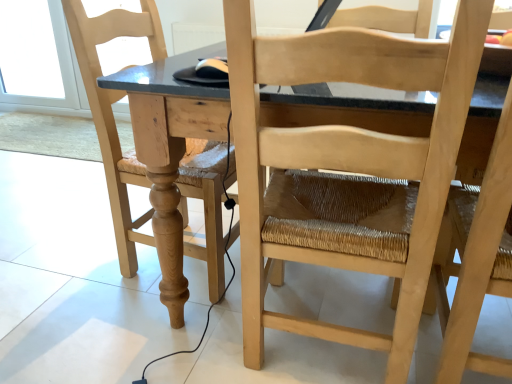
You are a GUI agent. You are given a task and a screenshot of the screen. Output one action in this format:
    pyautogui.click(x=<x>, y=<y>)
    Task: Click on the vacant space situated on the left part of natural wood chair at left, the third chair positioned from the right
    
    Given the screenshot: What is the action you would take?
    pyautogui.click(x=70, y=263)